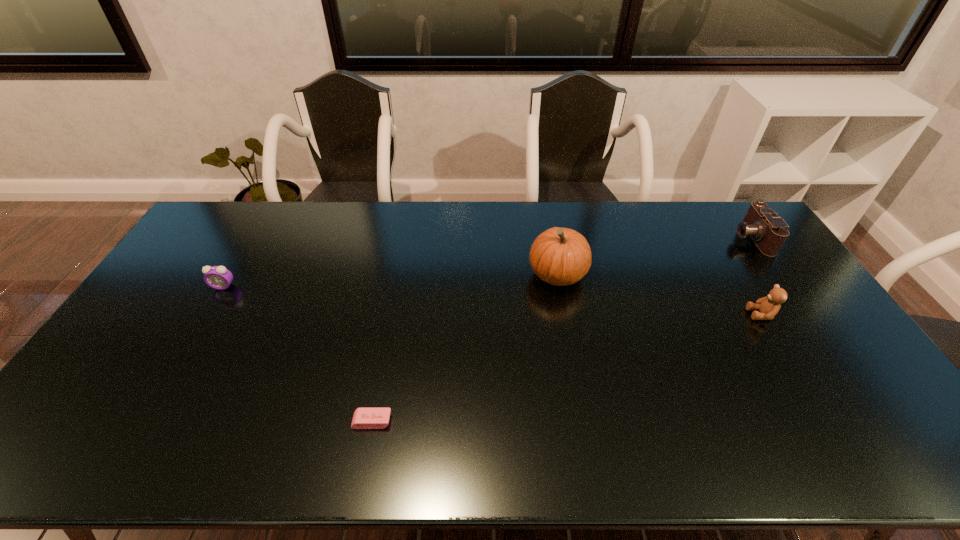
You are a GUI agent. You are given a task and a screenshot of the screen. Output one action in this format:
    pyautogui.click(x=<x>, y=<y>)
    Task: Click on the free space between the alarm clock and the rightmost object
    
    Given the screenshot: What is the action you would take?
    pyautogui.click(x=487, y=262)

Where is `free spot between the camera and the pumpkin`? The width and height of the screenshot is (960, 540). free spot between the camera and the pumpkin is located at coordinates 654,256.

Locate an element on the screen. The height and width of the screenshot is (540, 960). vacant area between the pumpkin and the camera is located at coordinates (654, 256).

The image size is (960, 540). Find the location of `vacant point located between the second nearest object and the shortest object`. vacant point located between the second nearest object and the shortest object is located at coordinates (566, 368).

Locate an element on the screen. vacant region between the fourth object from right to left and the fourth tallest object is located at coordinates (298, 354).

The image size is (960, 540). I want to click on vacant point located between the shortest object and the second nearest object, so point(566,368).

You are a GUI agent. You are given a task and a screenshot of the screen. Output one action in this format:
    pyautogui.click(x=<x>, y=<y>)
    Task: Click on the free space between the alarm clock and the second object from left to right
    
    Given the screenshot: What is the action you would take?
    pyautogui.click(x=298, y=354)

The height and width of the screenshot is (540, 960). I want to click on the third closest object to the tallest object, so click(x=769, y=232).

You are a GUI agent. You are given a task and a screenshot of the screen. Output one action in this format:
    pyautogui.click(x=<x>, y=<y>)
    Task: Click on the second closest object relative to the second object from right to left
    The height and width of the screenshot is (540, 960).
    Given the screenshot: What is the action you would take?
    pyautogui.click(x=559, y=256)

The image size is (960, 540). In order to click on vacant point that satisfies the following two spatial constraints: 1. on the front-facing side of the camera; 2. on the face of the alarm clock in this screenshot , I will do `click(784, 286)`.